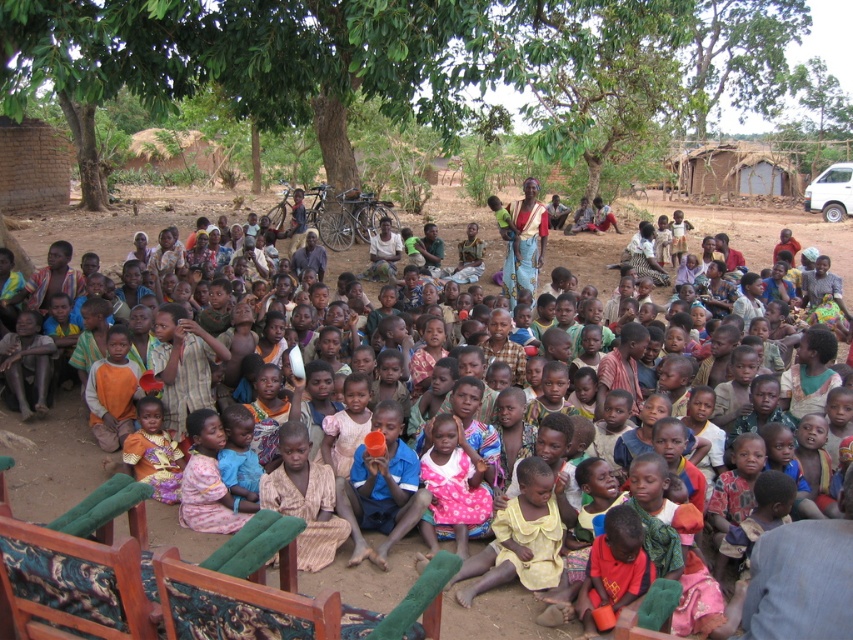
You are standing in the scene and want to move from point (x=724, y=12) to point (x=126, y=234). Which direction should you move to get closer to your destination?

To move from point (x=724, y=12) to point (x=126, y=234), you should move downward and to the right because point (x=724, y=12) is further away from the viewer compared to point (x=126, y=234).

You are a photographer trying to capture a group photo of the children. You want to ensure that the green leafy tree at center and the multicolored fabric dress at center are both clearly visible in the frame. Given their sizes, which object should you focus on first to ensure proper exposure?

The green leafy tree at center is larger in size than the multicolored fabric dress at center, so you should focus on the green leafy tree at center first to ensure proper exposure.

You are a photographer trying to capture a photo of the multicolored fabric dress at center and the green leafy tree at center. From the perspective of someone standing in front of the scene, which object is located to the left of the other?

The green leafy tree at center is positioned on the left side of multicolored fabric dress at center.